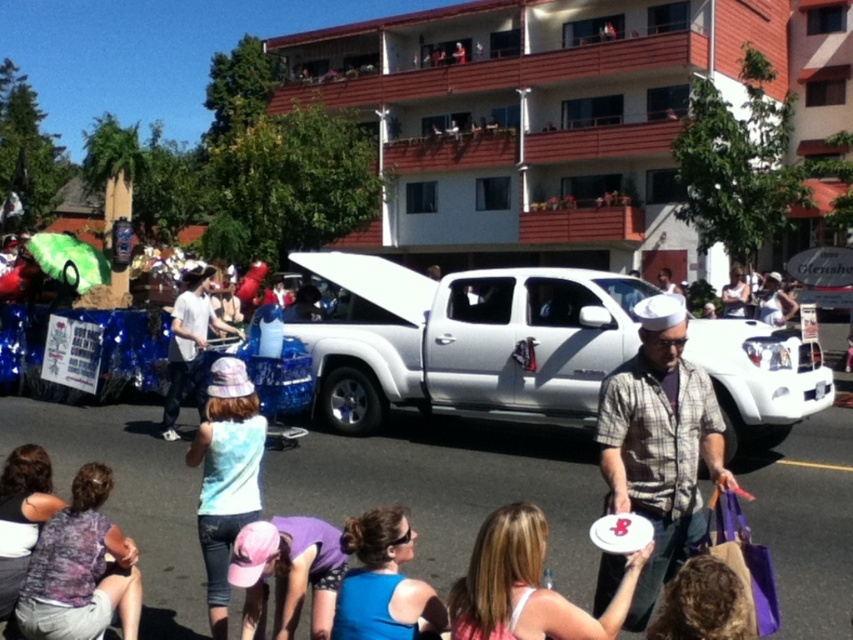
You are a photographer trying to capture the entire white metallic pickup truck at center and the purple fabric cap at lower center in a single frame. Based on their sizes, which object should you position closer to the camera to ensure both fit in the photo?

The white metallic pickup truck at center is narrower than the purple fabric cap at lower center. To fit both in the frame, position the purple fabric cap at lower center closer to the camera since it is wider and requires more space.

You are a photographer trying to capture the entire scene of the white metallic pickup truck at center and the blue fabric shirt at center in one frame. Based on their sizes, which object should you focus on to ensure both fit in the photo?

The white metallic pickup truck at center is narrower than the blue fabric shirt at center, so focusing on the truck and adjusting the camera angle to include the shirt would allow both to fit in the frame.

You are standing at the center of the image. There is a point marked at coordinates (x=465, y=340). What object is located at that point?

The object at point (x=465, y=340) is the white metallic pickup truck at center.